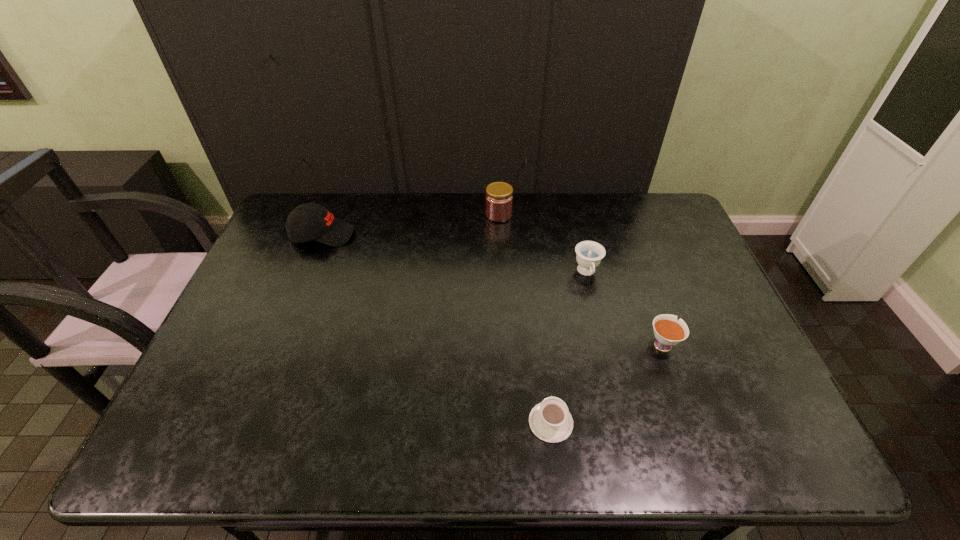
Where is `teacup that stands as the third closest to the leftmost object`? teacup that stands as the third closest to the leftmost object is located at coordinates (668, 332).

What are the coordinates of `free location that satisfies the following two spatial constraints: 1. on the handle side of the shortest teacup; 2. on the front-facing side of the leftmost object` in the screenshot? It's located at (528, 234).

Locate an element on the screen. The height and width of the screenshot is (540, 960). free spot that satisfies the following two spatial constraints: 1. on the front-facing side of the leftmost object; 2. on the side of the second nearest teacup with the handle is located at coordinates (280, 343).

The width and height of the screenshot is (960, 540). What are the coordinates of `vacant position in the image that satisfies the following two spatial constraints: 1. on the front-facing side of the baseball cap; 2. on the handle side of the shortest object` in the screenshot? It's located at (250, 422).

You are a GUI agent. You are given a task and a screenshot of the screen. Output one action in this format:
    pyautogui.click(x=<x>, y=<y>)
    Task: Click on the free location that satisfies the following two spatial constraints: 1. on the handle side of the nearest object; 2. on the front-facing side of the leftmost object
    Image resolution: width=960 pixels, height=540 pixels.
    Given the screenshot: What is the action you would take?
    pyautogui.click(x=528, y=234)